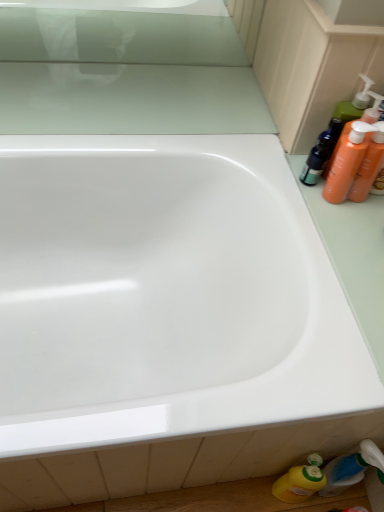
In order to click on free location to the left of orange plastic bottles at right, which ranks as the second toiletry in bottom-to-top order in this screenshot , I will do (285, 173).